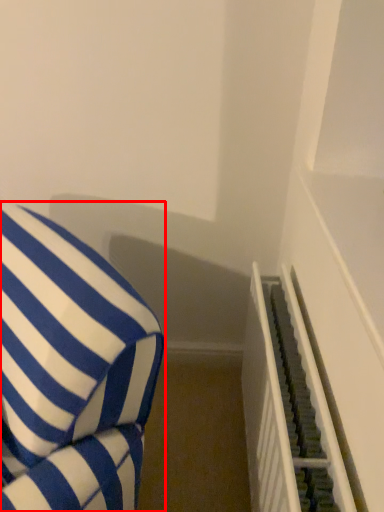
Question: From the image's perspective, what is the correct spatial relationship of furniture (annotated by the red box) in relation to stairwell?

Choices:
 (A) below
 (B) above

Answer: (B)